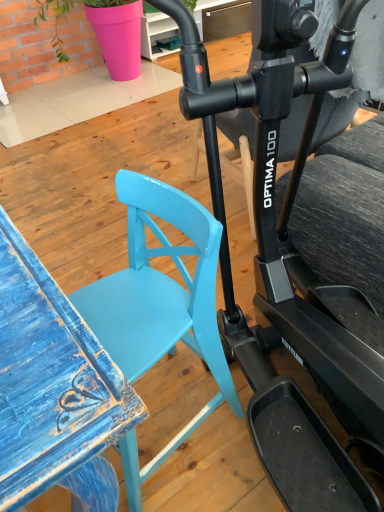
Question: In terms of height, does glossy black stationary bicycle at center look taller or shorter compared to matte blue chair at center?

Choices:
 (A) short
 (B) tall

Answer: (B)

Question: From the image's perspective, is glossy black stationary bicycle at center located above or below matte blue chair at center?

Choices:
 (A) below
 (B) above

Answer: (B)

Question: From a real-world perspective, is glossy black stationary bicycle at center physically located above or below matte blue chair at center?

Choices:
 (A) below
 (B) above

Answer: (B)

Question: Looking at their shapes, would you say matte blue chair at center is wider or thinner than glossy black stationary bicycle at center?

Choices:
 (A) thin
 (B) wide

Answer: (A)

Question: Does point (142, 243) appear closer or farther from the camera than point (269, 53)?

Choices:
 (A) farther
 (B) closer

Answer: (A)

Question: Considering the positions of matte blue chair at center and glossy black stationary bicycle at center in the image, is matte blue chair at center bigger or smaller than glossy black stationary bicycle at center?

Choices:
 (A) small
 (B) big

Answer: (A)

Question: From the image's perspective, is matte blue chair at center located above or below glossy black stationary bicycle at center?

Choices:
 (A) above
 (B) below

Answer: (B)